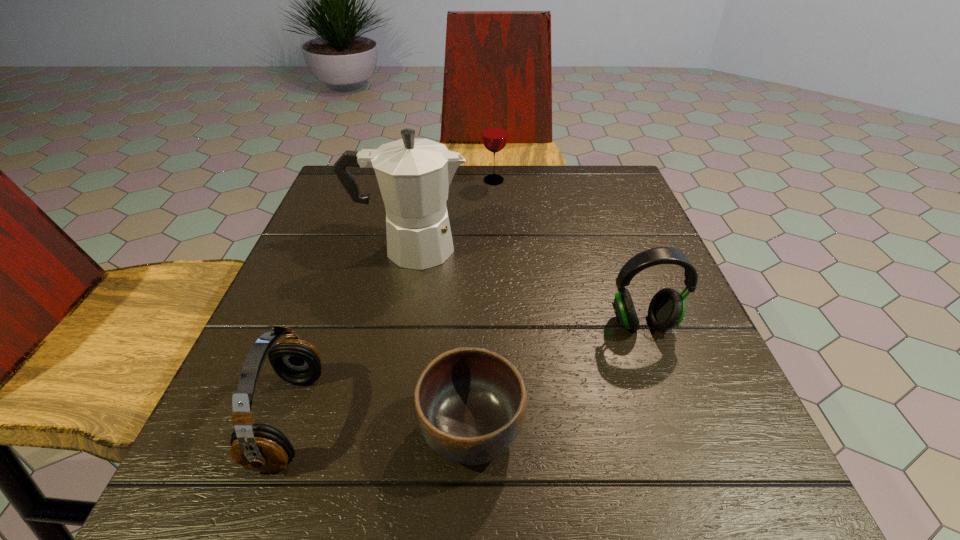
In order to click on blank area at the near edge in this screenshot , I will do pos(542,514).

Image resolution: width=960 pixels, height=540 pixels. I want to click on blank space at the right edge, so click(x=641, y=367).

This screenshot has width=960, height=540. In the image, there is a desktop. In order to click on free space at the far left corner in this screenshot , I will do `click(336, 206)`.

In the image, there is a desktop. Find the location of `free space at the far right corner`. free space at the far right corner is located at coordinates (605, 190).

You are a GUI agent. You are given a task and a screenshot of the screen. Output one action in this format:
    pyautogui.click(x=<x>, y=<y>)
    Task: Click on the vacant region at the near right corner
    
    Given the screenshot: What is the action you would take?
    pyautogui.click(x=709, y=458)

Locate an element on the screen. free space between the glass and the left headset is located at coordinates (392, 300).

Find the location of `free point between the right headset and the farthest object`. free point between the right headset and the farthest object is located at coordinates (567, 252).

Locate an element on the screen. The height and width of the screenshot is (540, 960). vacant space that is in between the farthest object and the left headset is located at coordinates (392, 300).

I want to click on vacant space that's between the nearer headset and the farthest object, so click(392, 300).

I want to click on vacant area between the nearer headset and the bowl, so click(x=380, y=425).